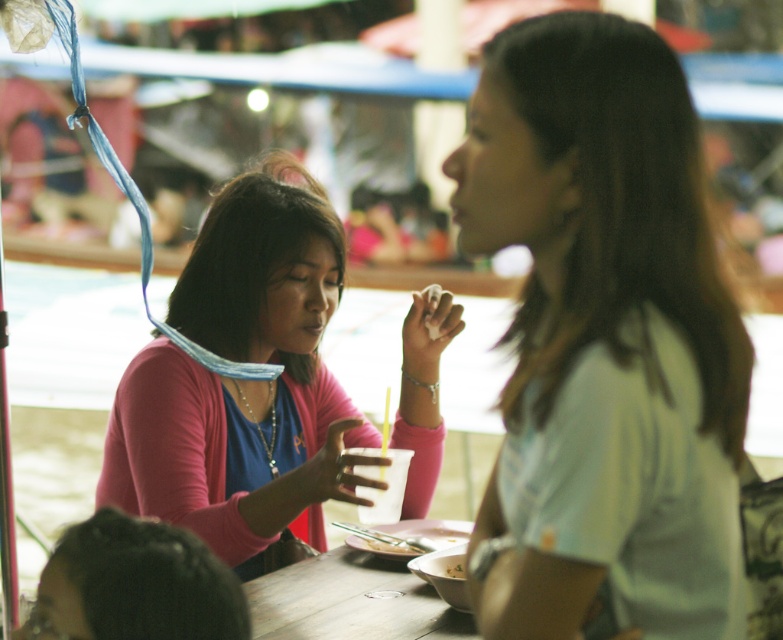
You are a photographer trying to capture a candid shot of the light beige shirt at right and the white matte bowl at lower center. Since you want the bowl to be in focus, which subject should you adjust your camera to focus on first?

The light beige shirt at right is in front of the white matte bowl at lower center, so to focus on the bowl first, adjust the camera to focus on the white matte bowl at lower center.

You are a photographer at the market and want to take a photo of both the light beige shirt at right and the pink matte sweater at center. However, you need to ensure that both subjects are fully visible in the frame. Based on their positions, which subject should you focus on first to avoid one blocking the other?

The light beige shirt at right is in front of the pink matte sweater at center, so you should focus on the light beige shirt at right first to ensure it doesn not block the view of the pink matte sweater at center.